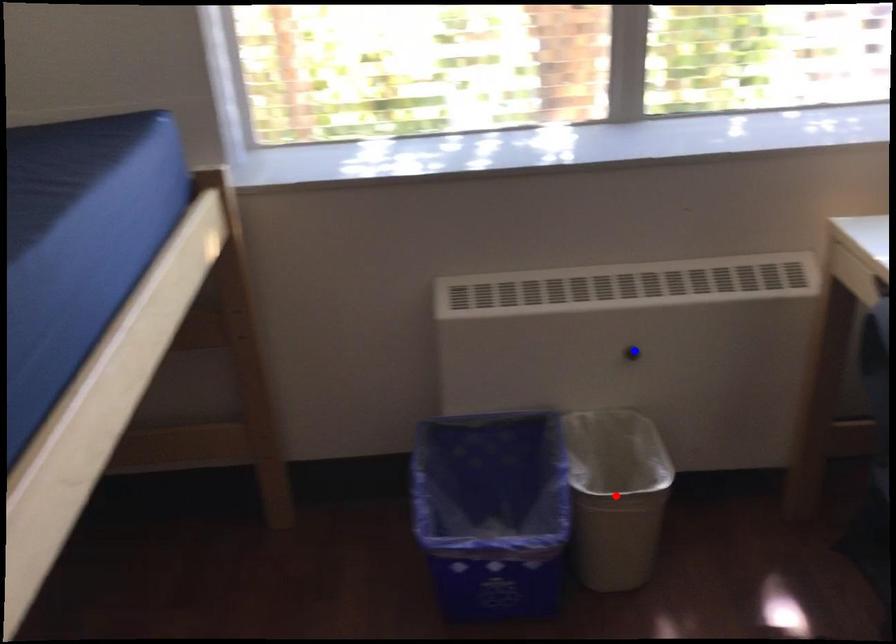
Question: Which of the two points in the image is closer to the camera?

Choices:
 (A) Blue point is closer.
 (B) Red point is closer.

Answer: (B)